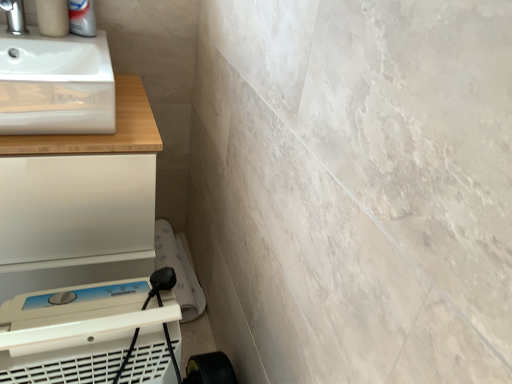
Question: Is white glossy sink at upper left smaller than white matte counter at upper left?

Choices:
 (A) yes
 (B) no

Answer: (A)

Question: Does white glossy sink at upper left have a greater height compared to white matte counter at upper left?

Choices:
 (A) no
 (B) yes

Answer: (A)

Question: From a real-world perspective, is white glossy sink at upper left positioned over white matte counter at upper left based on gravity?

Choices:
 (A) no
 (B) yes

Answer: (B)

Question: Is white glossy sink at upper left beside white matte counter at upper left?

Choices:
 (A) yes
 (B) no

Answer: (B)

Question: Is white matte counter at upper left at the back of white glossy sink at upper left?

Choices:
 (A) no
 (B) yes

Answer: (A)

Question: Is white glossy sink at upper left behind white matte counter at upper left?

Choices:
 (A) no
 (B) yes

Answer: (A)

Question: Does satin nickel faucet at upper left have a greater height compared to white matte counter at upper left?

Choices:
 (A) yes
 (B) no

Answer: (B)

Question: Is satin nickel faucet at upper left not close to white matte counter at upper left?

Choices:
 (A) yes
 (B) no

Answer: (B)

Question: Is satin nickel faucet at upper left looking in the opposite direction of white matte counter at upper left?

Choices:
 (A) yes
 (B) no

Answer: (B)

Question: Is satin nickel faucet at upper left oriented towards white matte counter at upper left?

Choices:
 (A) no
 (B) yes

Answer: (A)

Question: Is satin nickel faucet at upper left surrounding white matte counter at upper left?

Choices:
 (A) yes
 (B) no

Answer: (B)

Question: Is the position of satin nickel faucet at upper left more distant than that of white matte counter at upper left?

Choices:
 (A) yes
 (B) no

Answer: (A)

Question: Can you confirm if white matte counter at upper left is positioned to the right of satin nickel faucet at upper left?

Choices:
 (A) yes
 (B) no

Answer: (A)